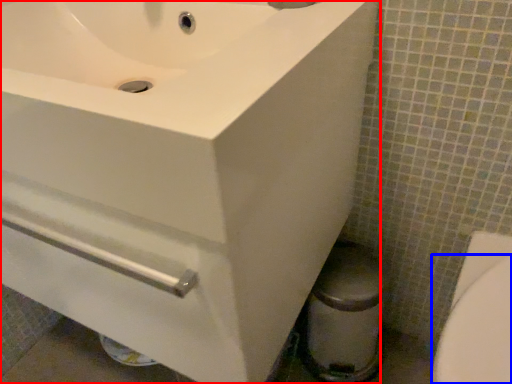
Question: Which object is further to the camera taking this photo, sink (highlighted by a red box) or bidet (highlighted by a blue box)?

Choices:
 (A) sink
 (B) bidet

Answer: (B)